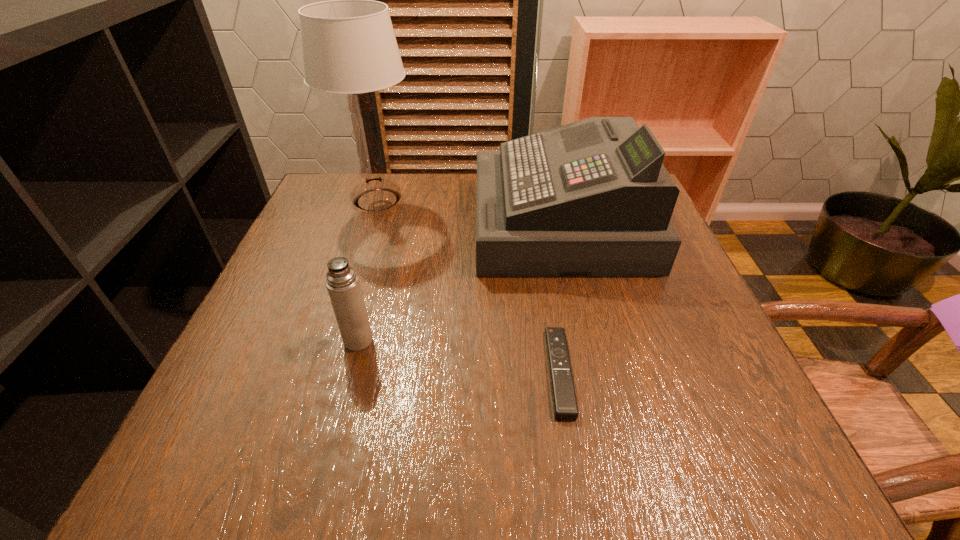
At what (x,y) coordinates should I click in order to perform the action: click on unoccupied position between the third tallest object and the second tallest object. Please return your answer as a coordinate pair (x, y). Image resolution: width=960 pixels, height=540 pixels. Looking at the image, I should click on (459, 281).

Locate an element on the screen. Image resolution: width=960 pixels, height=540 pixels. empty location between the shortest object and the cash register is located at coordinates pos(560,298).

Locate an element on the screen. object that is the third closest to the table lamp is located at coordinates (565, 406).

The width and height of the screenshot is (960, 540). Identify the location of object that stands as the closest to the remote control. (590, 198).

Find the location of a particular element. The height and width of the screenshot is (540, 960). free space that satisfies the following two spatial constraints: 1. on the front-facing side of the table lamp; 2. on the left side of the second shortest object is located at coordinates (333, 340).

Find the location of a particular element. The width and height of the screenshot is (960, 540). free spot that satisfies the following two spatial constraints: 1. on the front-facing side of the remote control; 2. on the right side of the table lamp is located at coordinates click(323, 372).

Where is `free location that satisfies the following two spatial constraints: 1. on the front-facing side of the table lamp; 2. on the right side of the thermos bottle`? The width and height of the screenshot is (960, 540). free location that satisfies the following two spatial constraints: 1. on the front-facing side of the table lamp; 2. on the right side of the thermos bottle is located at coordinates [333, 340].

At what (x,y) coordinates should I click in order to perform the action: click on free space that satisfies the following two spatial constraints: 1. on the front-facing side of the shortest object; 2. on the left side of the tallest object. Please return your answer as a coordinate pair (x, y). Looking at the image, I should click on (323, 372).

You are a GUI agent. You are given a task and a screenshot of the screen. Output one action in this format:
    pyautogui.click(x=<x>, y=<y>)
    Task: Click on the free spot that satisfies the following two spatial constraints: 1. on the front-facing side of the thermos bottle; 2. on the right side of the table lamp
    The height and width of the screenshot is (540, 960).
    Given the screenshot: What is the action you would take?
    [333, 340]